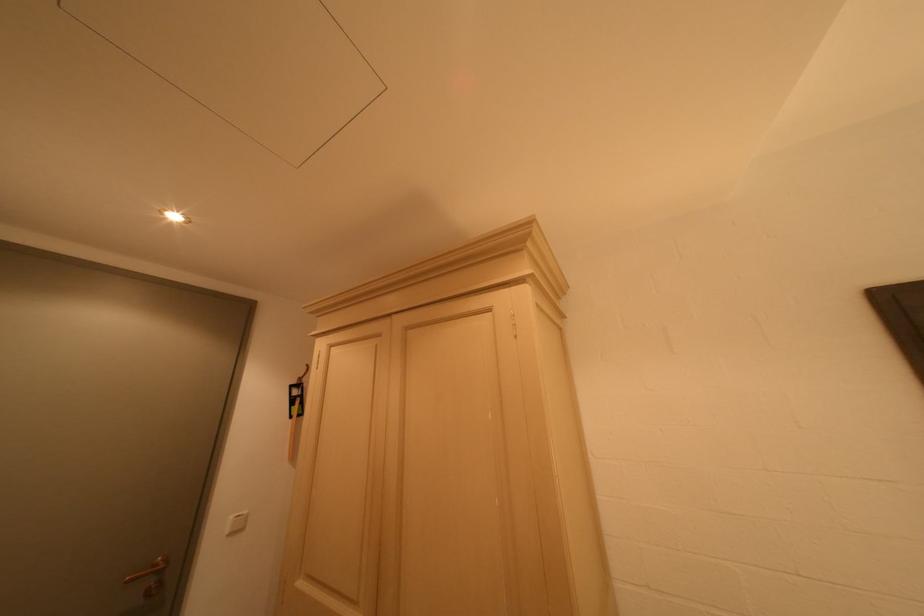
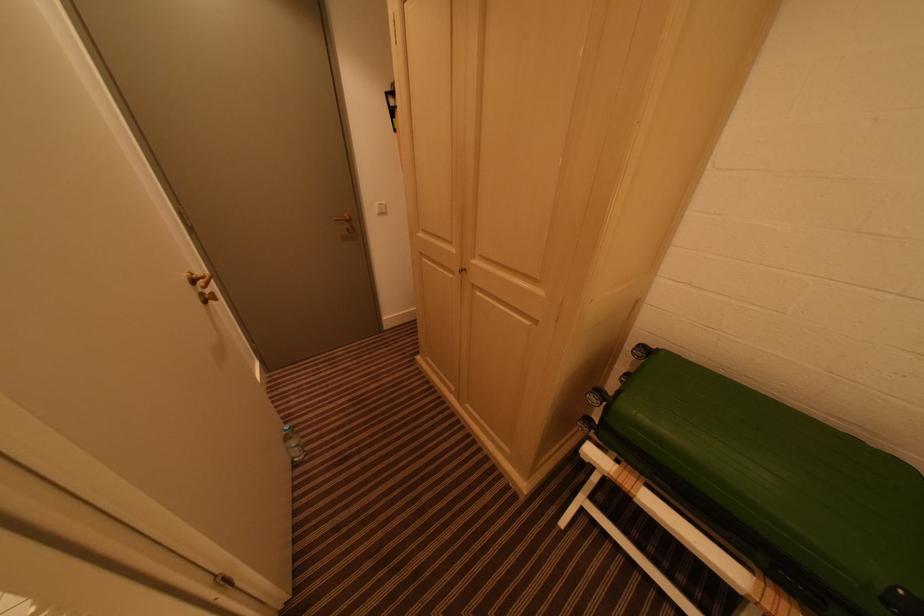
First-person continuous shooting, in which direction is the camera rotating?

The camera rotated toward left-down.